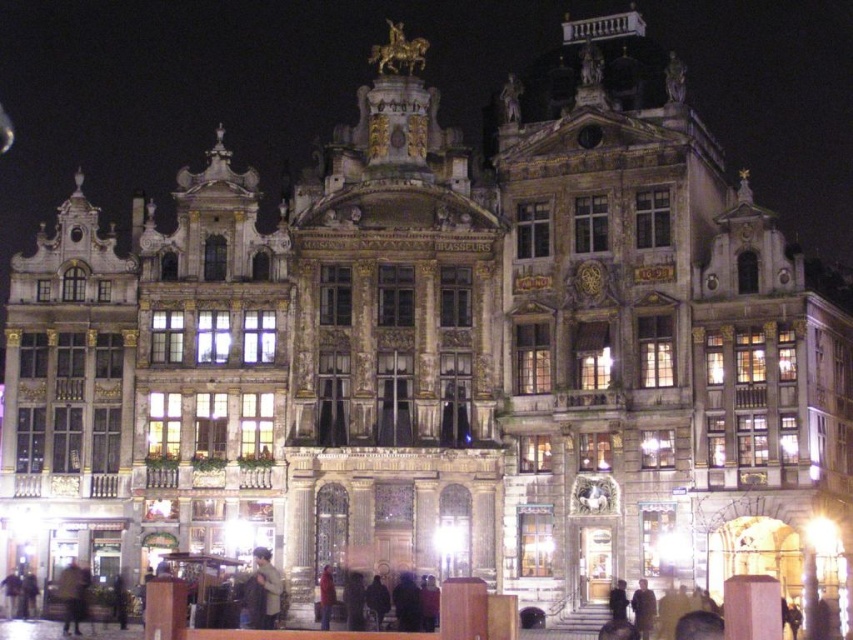
Question: Is dark brown leather jacket at lower center positioned behind dark brown leather jacket at lower left?

Choices:
 (A) yes
 (B) no

Answer: (B)

Question: Does dark brown leather jacket at lower center appear on the right side of dark brown leather jacket at lower left?

Choices:
 (A) no
 (B) yes

Answer: (B)

Question: Does dark brown leather jacket at lower center appear over dark brown leather jacket at lower left?

Choices:
 (A) no
 (B) yes

Answer: (B)